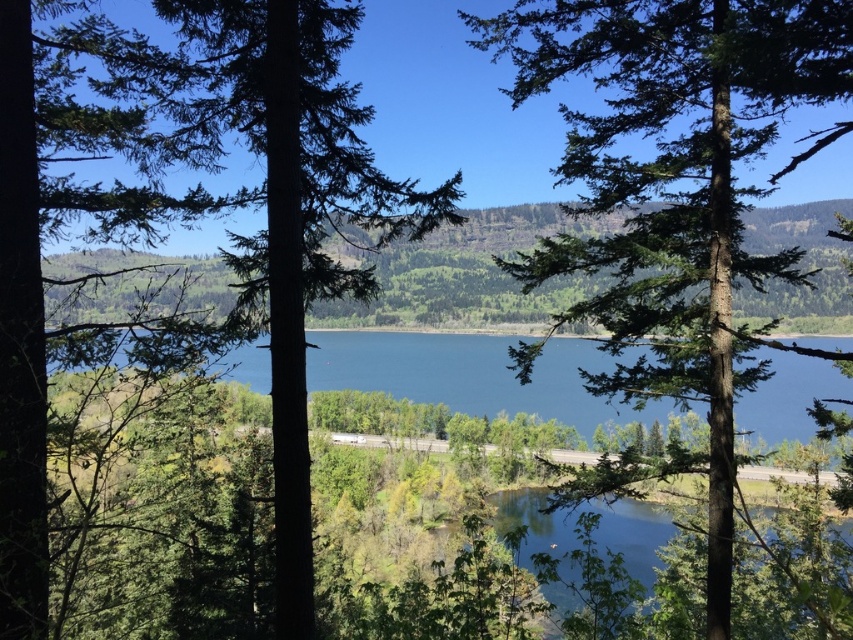
Question: Which point is farther to the camera?

Choices:
 (A) blue glassy water at center
 (B) clear blue water at center
 (C) green textured tree at center

Answer: (B)

Question: Which of the following is the farthest from the observer?

Choices:
 (A) (463, 403)
 (B) (293, 563)
 (C) (502, 508)

Answer: (A)

Question: Among these objects, which one is farthest from the camera?

Choices:
 (A) blue glassy water at center
 (B) green matte tree at center

Answer: (A)

Question: Does green textured tree at center have a smaller size compared to green matte tree at center?

Choices:
 (A) yes
 (B) no

Answer: (B)

Question: Can you confirm if green matte tree at center is positioned to the right of blue glassy water at center?

Choices:
 (A) no
 (B) yes

Answer: (A)

Question: Is green matte tree at center to the right of clear blue water at center from the viewer's perspective?

Choices:
 (A) yes
 (B) no

Answer: (B)